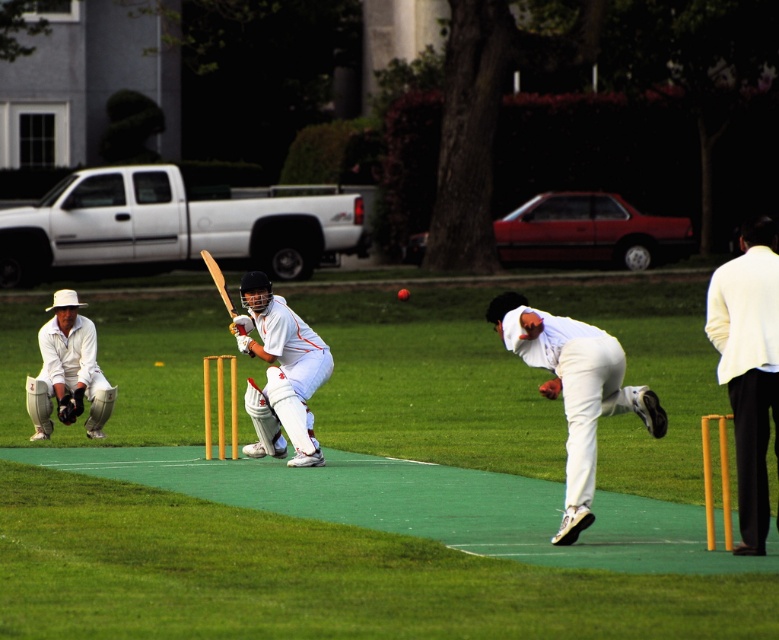
Does white cloth jacket at upper right have a greater height compared to white clothed bowler at center?

In fact, white cloth jacket at upper right may be shorter than white clothed bowler at center.

Can you confirm if white cloth jacket at upper right is smaller than white clothed bowler at center?

Yes, white cloth jacket at upper right is smaller than white clothed bowler at center.

I want to click on white cloth jacket at upper right, so click(x=749, y=365).

Which is behind, point (307, 464) or point (85, 396)?

Point (85, 396)

Does white matte cricket bat at center have a lesser height compared to white matte cricket gear at left?

No.

This screenshot has height=640, width=779. Identify the location of white matte cricket bat at center. (284, 362).

This screenshot has height=640, width=779. Identify the location of white matte cricket bat at center. (284, 362).

In the scene shown: Does white cloth jacket at upper right have a smaller size compared to white matte cricket bat at center?

Yes.

Does white cloth jacket at upper right have a larger size compared to white matte cricket bat at center?

Incorrect, white cloth jacket at upper right is not larger than white matte cricket bat at center.

The width and height of the screenshot is (779, 640). In order to click on white cloth jacket at upper right in this screenshot , I will do `click(749, 365)`.